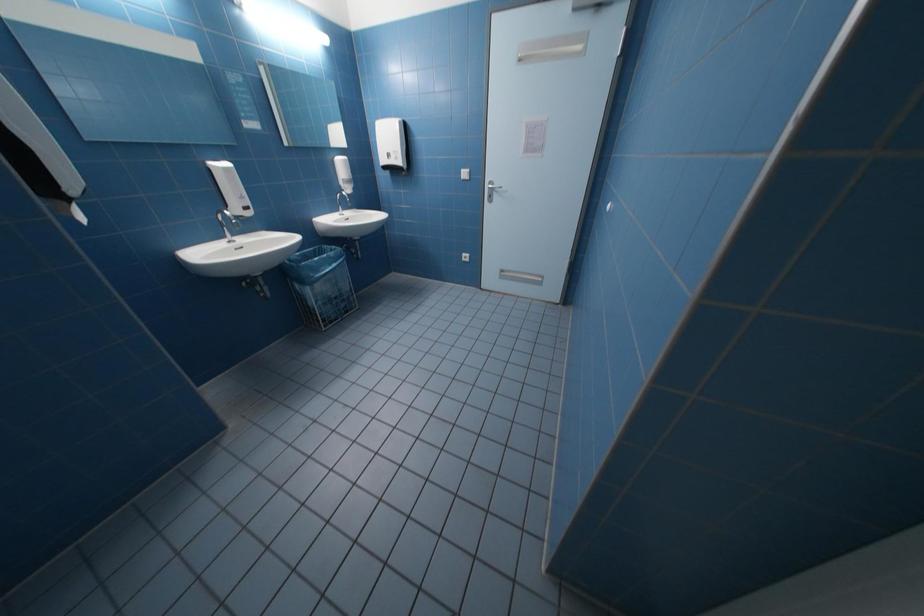
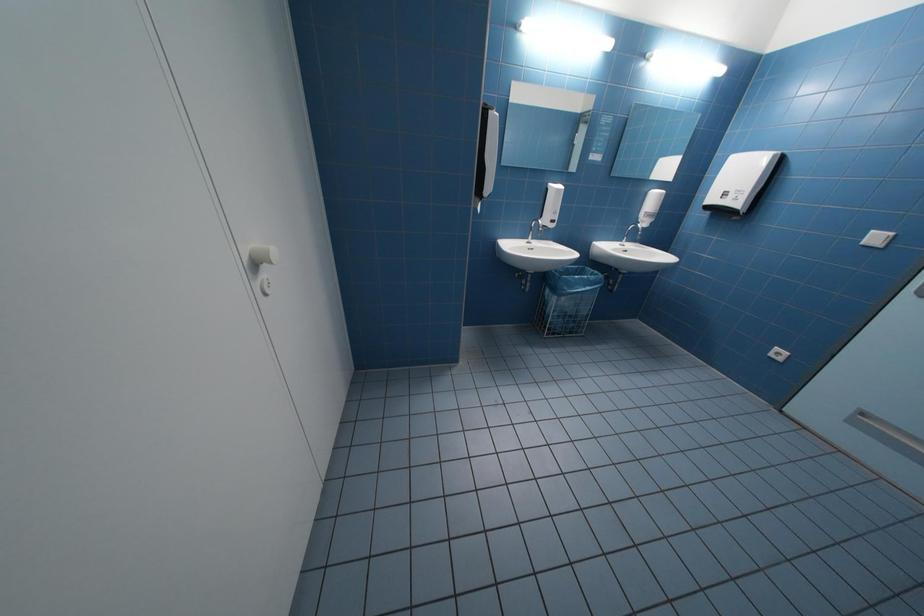
Question: The camera is either moving clockwise (left) or counter-clockwise (right) around the object. The first image is from the beginning of the video and the second image is from the end. Is the camera moving left or right when shooting the video?

Choices:
 (A) Left
 (B) Right

Answer: (B)